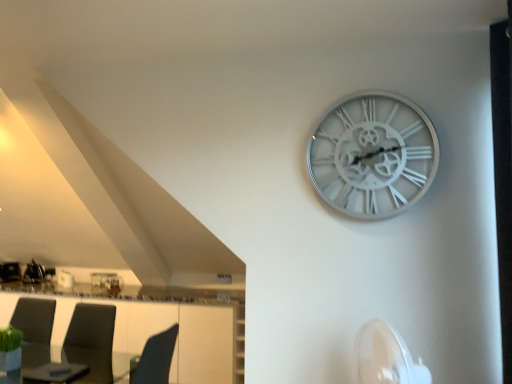
The height and width of the screenshot is (384, 512). Describe the element at coordinates (373, 155) in the screenshot. I see `white metallic clock at upper right` at that location.

You are a GUI agent. You are given a task and a screenshot of the screen. Output one action in this format:
    pyautogui.click(x=<x>, y=<y>)
    Task: Click on the white metallic clock at upper right
    This screenshot has width=512, height=384.
    Given the screenshot: What is the action you would take?
    click(x=373, y=155)

You are a GUI agent. You are given a task and a screenshot of the screen. Output one action in this format:
    pyautogui.click(x=<x>, y=<y>)
    Task: Click on the white metallic clock at upper right
    
    Given the screenshot: What is the action you would take?
    pyautogui.click(x=373, y=155)